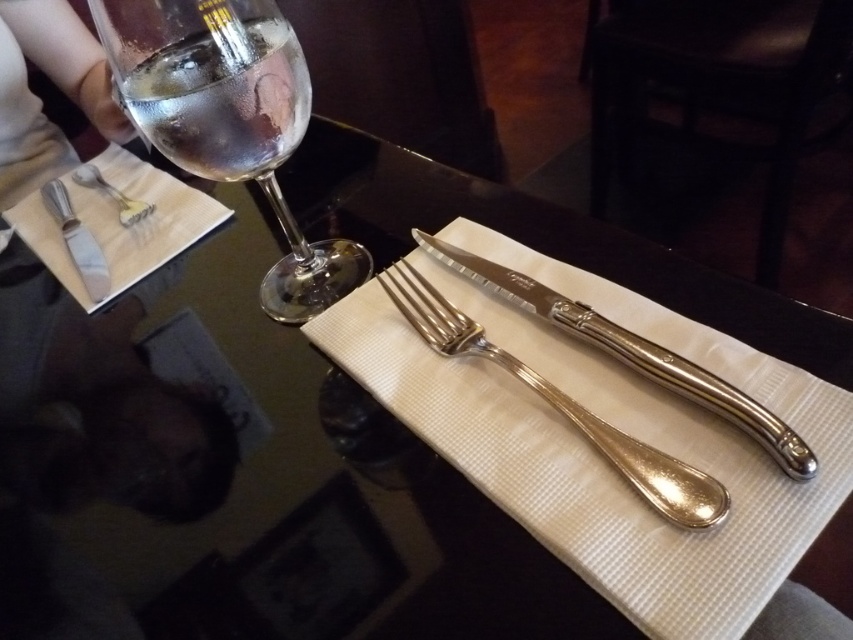
Is clear glass wine at upper left smaller than polished silver knife at upper left?

Indeed, clear glass wine at upper left has a smaller size compared to polished silver knife at upper left.

Between point (274, 51) and point (62, 211), which one is positioned in front?

Positioned in front is point (274, 51).

At what (x,y) coordinates should I click in order to perform the action: click on clear glass wine at upper left. Please return your answer as a coordinate pair (x, y). This screenshot has width=853, height=640. Looking at the image, I should click on (222, 99).

Between polished silver knife at upper left and polished silver fork at upper left, which one is positioned lower?

polished silver knife at upper left

Which is behind, point (85, 230) or point (141, 204)?

Point (141, 204)

Between point (86, 268) and point (132, 211), which one is positioned behind?

The point (132, 211) is behind.

Locate an element on the screen. polished silver knife at upper left is located at coordinates (77, 241).

Does point (277, 60) come in front of point (91, 241)?

That is True.

Which is more to the left, clear glass wine glass at upper left or polished silver knife at upper left?

From the viewer's perspective, polished silver knife at upper left appears more on the left side.

Who is more forward, (236, 106) or (74, 237)?

Point (236, 106) is more forward.

In order to click on clear glass wine glass at upper left in this screenshot , I will do [228, 118].